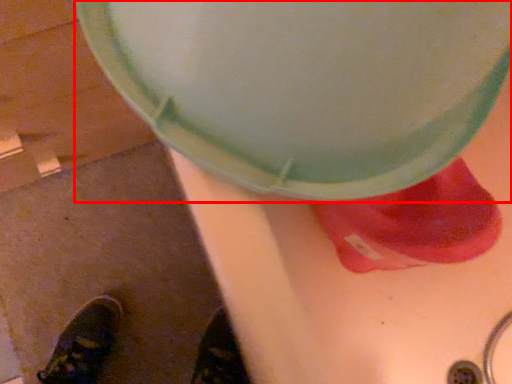
Question: From the image's perspective, where is lid (annotated by the red box) located in relation to footwear in the image?

Choices:
 (A) above
 (B) below

Answer: (A)